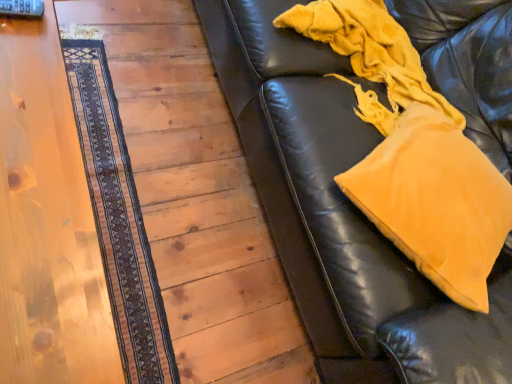
Identify the location of blank space above dark brown woven mat at left (from a real-world perspective). The image size is (512, 384). (111, 187).